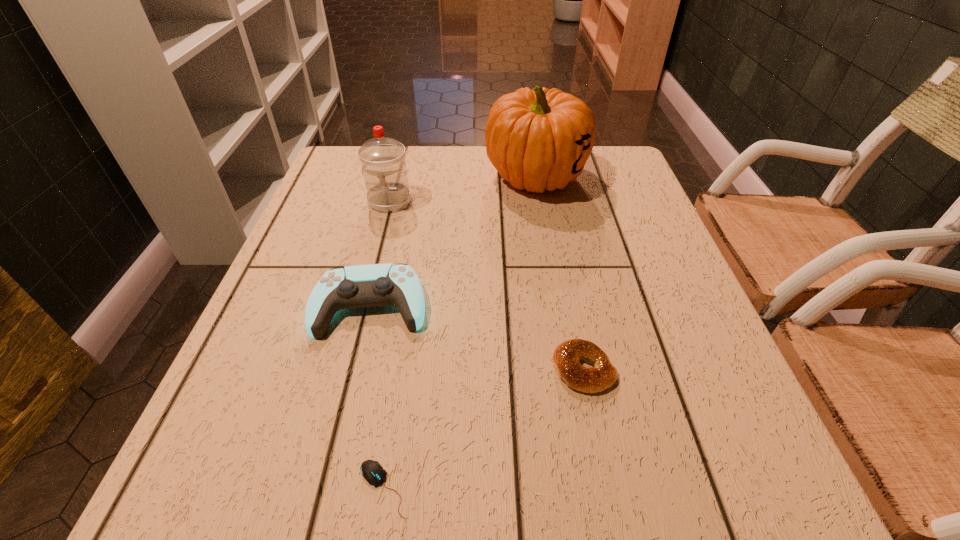
You are a GUI agent. You are given a task and a screenshot of the screen. Output one action in this format:
    pyautogui.click(x=<x>, y=<y>)
    Task: Click on the vacant area situated 0.120m on the back of the third nearest object
    The image size is (960, 540).
    Given the screenshot: What is the action you would take?
    pyautogui.click(x=387, y=239)

Identify the location of vacant space situated 0.130m on the right of the second nearest object. (693, 369).

Locate an element on the screen. The image size is (960, 540). vacant space positioned 0.100m on the right of the mouse is located at coordinates (483, 488).

Locate an element on the screen. This screenshot has height=540, width=960. pumpkin that is positioned at the far edge is located at coordinates (538, 139).

Locate an element on the screen. The height and width of the screenshot is (540, 960). water bottle that is at the far edge is located at coordinates (383, 160).

The height and width of the screenshot is (540, 960). I want to click on object that is at the near edge, so click(x=372, y=471).

You are a GUI agent. You are given a task and a screenshot of the screen. Output one action in this format:
    pyautogui.click(x=<x>, y=<y>)
    Task: Click on the water bottle located at the left edge
    This screenshot has width=960, height=540.
    Given the screenshot: What is the action you would take?
    pyautogui.click(x=383, y=160)

Locate an element on the screen. Image resolution: width=960 pixels, height=540 pixels. control that is at the left edge is located at coordinates (373, 285).

Where is `object that is at the right edge`? object that is at the right edge is located at coordinates (538, 139).

Where is `object at the far left corner`? object at the far left corner is located at coordinates (383, 160).